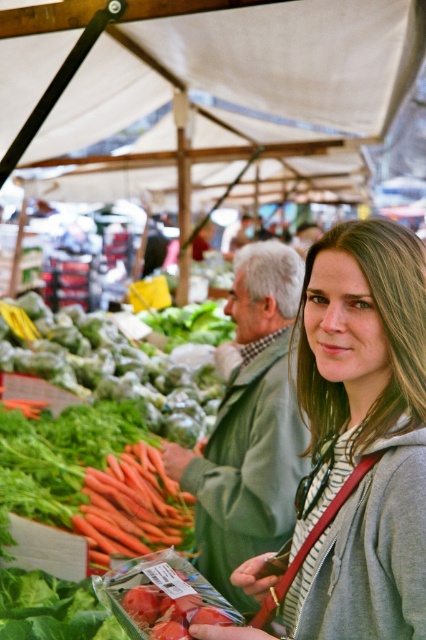
Can you confirm if white fabric canopy at upper center is bigger than matte gray hoodie at center?

Yes, white fabric canopy at upper center is bigger than matte gray hoodie at center.

Is white fabric canopy at upper center positioned before matte gray hoodie at center?

That is False.

Is point (322, 189) more distant than point (406, 451)?

Yes, it is behind point (406, 451).

The width and height of the screenshot is (426, 640). What are the coordinates of `white fabric canopy at upper center` in the screenshot? It's located at (x=230, y=100).

Is white fabric canopy at upper center to the right of orange carrot at center from the viewer's perspective?

Correct, you'll find white fabric canopy at upper center to the right of orange carrot at center.

Does point (141, 129) come in front of point (23, 467)?

No, it is behind (23, 467).

At what (x,y) coordinates should I click in order to perform the action: click on white fabric canopy at upper center. Please return your answer as a coordinate pair (x, y). The width and height of the screenshot is (426, 640). Looking at the image, I should click on (230, 100).

Can you confirm if white fabric canopy at upper center is positioned below orange smooth carrot at center?

No, white fabric canopy at upper center is not below orange smooth carrot at center.

The image size is (426, 640). What do you see at coordinates (230, 100) in the screenshot? I see `white fabric canopy at upper center` at bounding box center [230, 100].

At what (x,y) coordinates should I click in order to perform the action: click on white fabric canopy at upper center. Please return your answer as a coordinate pair (x, y). This screenshot has width=426, height=640. Looking at the image, I should click on (230, 100).

Locate an element on the screen. This screenshot has height=640, width=426. white fabric canopy at upper center is located at coordinates (230, 100).